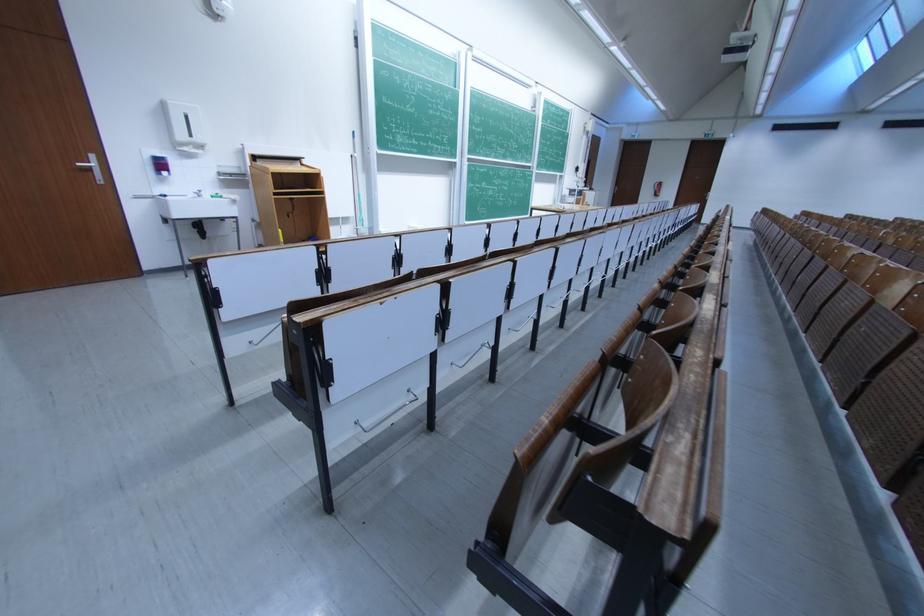
Find where to pull the silver door handle. Please return your answer as a coordinate pair (x, y).

(88, 163)